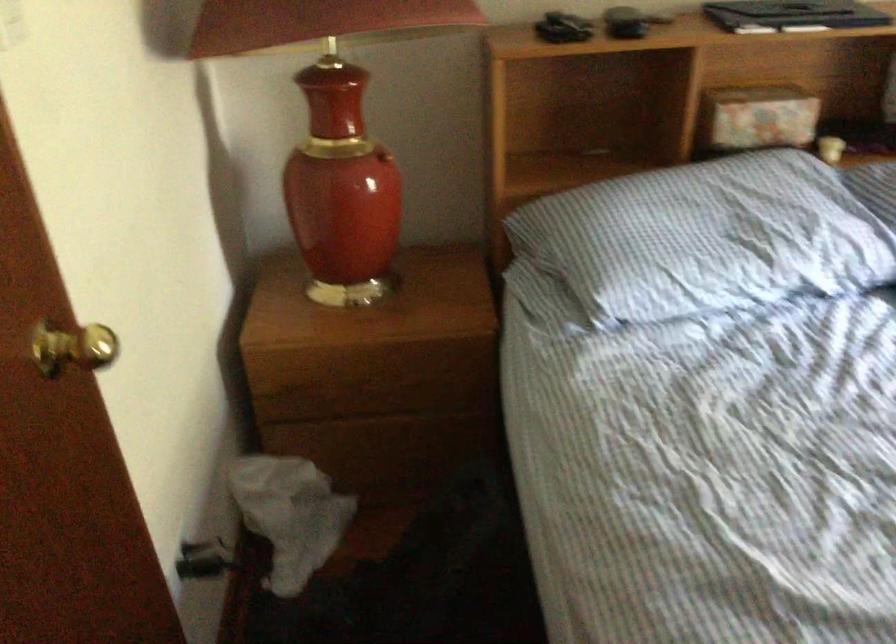
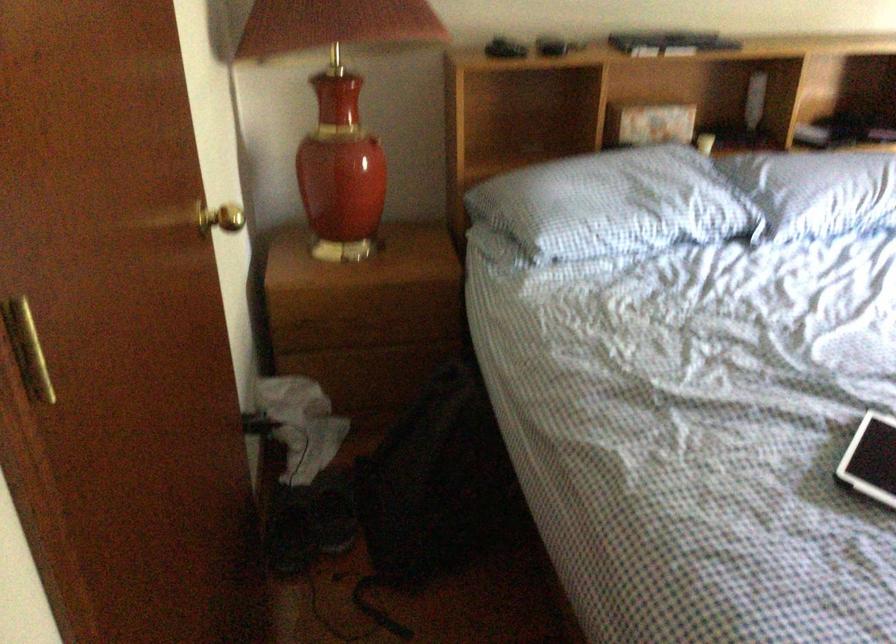
Question: I am providing you with two images of the same scene from different viewpoints. Please identify which objects are invisible in image2.

Choices:
 (A) black electrical plug
 (B) patterned wastebasket
 (C) gold door knob
 (D) small black tablet

Answer: (A)